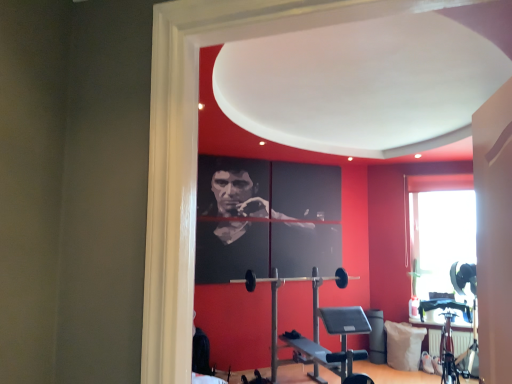
Find the location of `white fabric pillow at lower right`. white fabric pillow at lower right is located at coordinates (404, 345).

Measure the distance between white fabric pillow at lower right and camera.

They are 13.71 feet apart.

What do you see at coordinates (404, 345) in the screenshot?
I see `white fabric pillow at lower right` at bounding box center [404, 345].

Locate an element on the screen. This screenshot has width=512, height=384. black rubber barbell at center is located at coordinates point(295,279).

The width and height of the screenshot is (512, 384). Describe the element at coordinates (295, 279) in the screenshot. I see `black rubber barbell at center` at that location.

This screenshot has height=384, width=512. Find the location of `white fabric pillow at lower right`. white fabric pillow at lower right is located at coordinates (404, 345).

Does black rubber barbell at center appear on the left side of white fabric pillow at lower right?

Indeed, black rubber barbell at center is positioned on the left side of white fabric pillow at lower right.

Does black rubber barbell at center lie in front of white fabric pillow at lower right?

Yes.

Which is closer to the camera, (237, 281) or (394, 361)?

Clearly, point (237, 281) is more distant from the camera than point (394, 361).

From the image's perspective, which object appears higher, black rubber barbell at center or white fabric pillow at lower right?

black rubber barbell at center appears higher in the image.

From a real-world perspective, is black rubber barbell at center positioned under white fabric pillow at lower right based on gravity?

No, from a real-world perspective, black rubber barbell at center is not below white fabric pillow at lower right.

Considering the sizes of black rubber barbell at center and white fabric pillow at lower right in the image, is black rubber barbell at center wider or thinner than white fabric pillow at lower right?

Considering their sizes, black rubber barbell at center looks slimmer than white fabric pillow at lower right.

Does black rubber barbell at center have a lesser height compared to white fabric pillow at lower right?

Yes.

From the picture: Between black rubber barbell at center and white fabric pillow at lower right, which one has larger size?

black rubber barbell at center is bigger.

Would you say black rubber barbell at center is inside or outside white fabric pillow at lower right?

black rubber barbell at center is not enclosed by white fabric pillow at lower right.

Based on the photo, is black rubber barbell at center directly adjacent to white fabric pillow at lower right?

No, black rubber barbell at center is not touching white fabric pillow at lower right.

Could you tell me if black rubber barbell at center is facing white fabric pillow at lower right?

No, black rubber barbell at center is not facing towards white fabric pillow at lower right.

How many degrees apart are the facing directions of black rubber barbell at center and white fabric pillow at lower right?

They differ by 39.4 degrees in their facing directions.

The image size is (512, 384). What are the coordinates of `barbell that is in front of the white fabric pillow at lower right` in the screenshot? It's located at (295, 279).

Is white fabric pillow at lower right at the right side of black rubber barbell at center?

Yes.

Considering the positions of objects white fabric pillow at lower right and black rubber barbell at center in the image provided, who is in front, white fabric pillow at lower right or black rubber barbell at center?

black rubber barbell at center is more forward.

Considering the positions of points (404, 346) and (357, 277), is point (404, 346) farther from camera compared to point (357, 277)?

No, it is in front of (357, 277).

From the image's perspective, would you say white fabric pillow at lower right is positioned over black rubber barbell at center?

No, from the image's perspective, white fabric pillow at lower right is not over black rubber barbell at center.

From a real-world perspective, between white fabric pillow at lower right and black rubber barbell at center, who is vertically higher?

black rubber barbell at center.

Between white fabric pillow at lower right and black rubber barbell at center, which one has larger width?

Wider between the two is white fabric pillow at lower right.

Who is shorter, white fabric pillow at lower right or black rubber barbell at center?

With less height is black rubber barbell at center.

Does white fabric pillow at lower right have a larger size compared to black rubber barbell at center?

Incorrect, white fabric pillow at lower right is not larger than black rubber barbell at center.

Would you say black rubber barbell at center is part of white fabric pillow at lower right's contents?

No.

Is white fabric pillow at lower right beside black rubber barbell at center?

There is a gap between white fabric pillow at lower right and black rubber barbell at center.

Is white fabric pillow at lower right turned away from black rubber barbell at center?

No, black rubber barbell at center is not at the back of white fabric pillow at lower right.

What's the angular difference between white fabric pillow at lower right and black rubber barbell at center's facing directions?

The angular difference between white fabric pillow at lower right and black rubber barbell at center is 39.4 degrees.

Where is `pillow below the black rubber barbell at center (from a real-world perspective)`? pillow below the black rubber barbell at center (from a real-world perspective) is located at coordinates (404, 345).

You are a GUI agent. You are given a task and a screenshot of the screen. Output one action in this format:
    pyautogui.click(x=<x>, y=<y>)
    Task: Click on the barbell above the white fabric pillow at lower right (from a real-world perspective)
    Image resolution: width=512 pixels, height=384 pixels.
    Given the screenshot: What is the action you would take?
    pyautogui.click(x=295, y=279)

What are the coordinates of `barbell that appears on the left of white fabric pillow at lower right` in the screenshot? It's located at (295, 279).